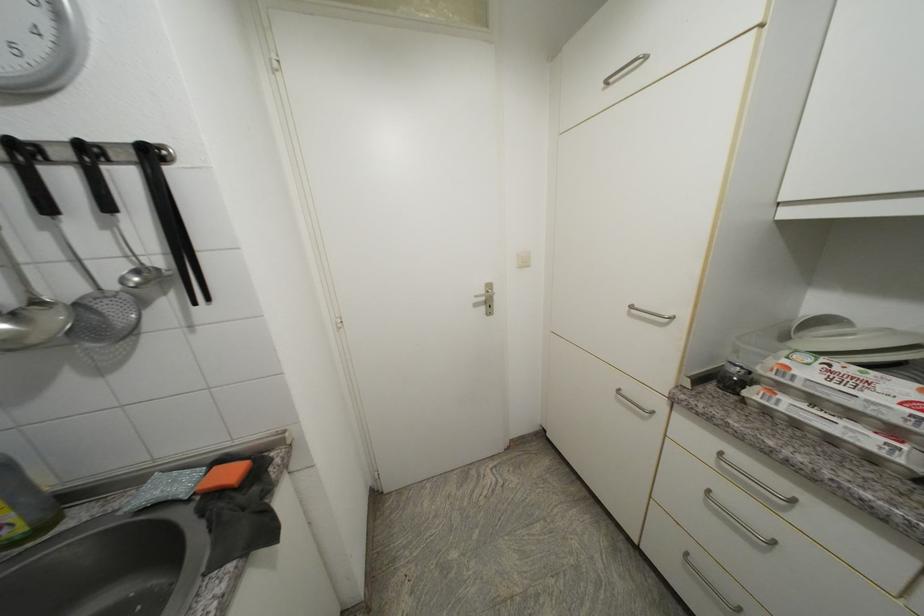
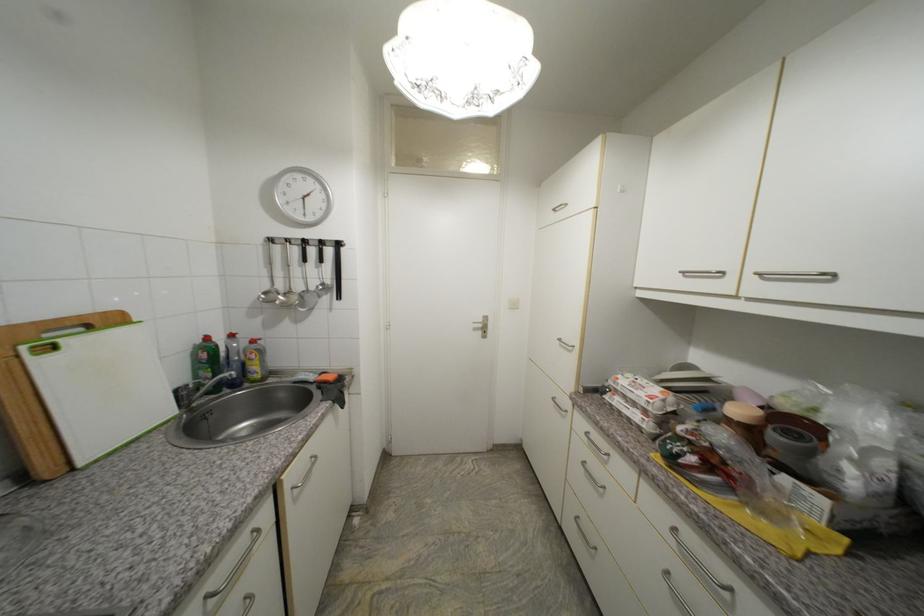
In the second image, find the point that corresponds to [489,293] in the first image.

(487, 322)